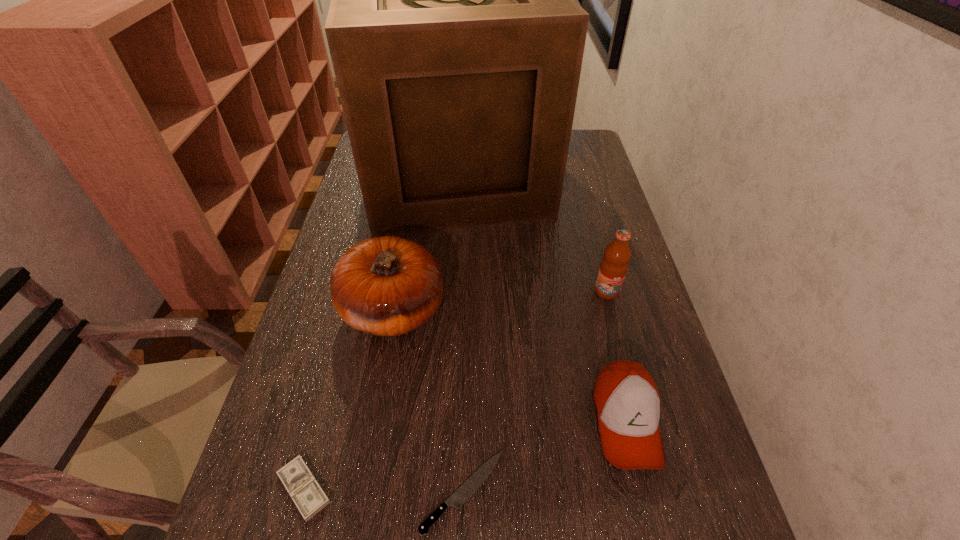
At what (x,y) coordinates should I click in order to perform the action: click on the fourth closest object to the tallest object. Please return your answer as a coordinate pair (x, y). The width and height of the screenshot is (960, 540). Looking at the image, I should click on (468, 488).

Identify which object is the fifth closest to the shortest object. Please provide its 2D coordinates. Your answer should be formatted as a tuple, i.e. [(x, y)], where the tuple contains the x and y coordinates of a point satisfying the conditions above.

[(457, 46)]